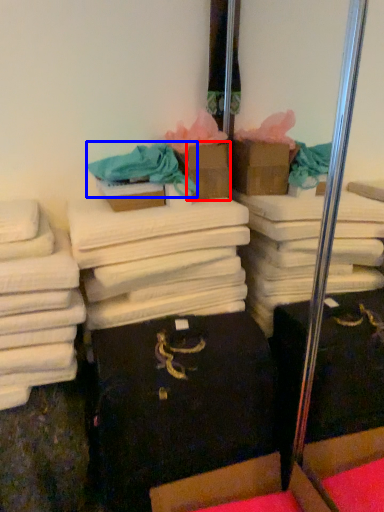
Question: Which object is further to the camera taking this photo, cardboard box (highlighted by a red box) or clothing (highlighted by a blue box)?

Choices:
 (A) cardboard box
 (B) clothing

Answer: (A)